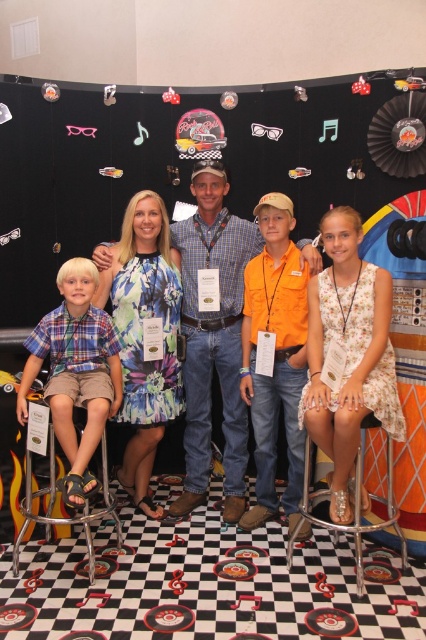
Based on the scene description, which object is positioned higher in the image, the checkered fabric shirt at center or the floral cotton dress at center?

The checkered fabric shirt at center is positioned higher than the floral cotton dress at center.

You are a photographer setting up for a group photo. You notice the plaid cotton shirt at left and the metallic silver bar stool at lower left. Which object is closer to the right side of the scene?

The plaid cotton shirt at left is positioned on the right side of the metallic silver bar stool at lower left, so the plaid cotton shirt at left is closer to the right side of the scene.